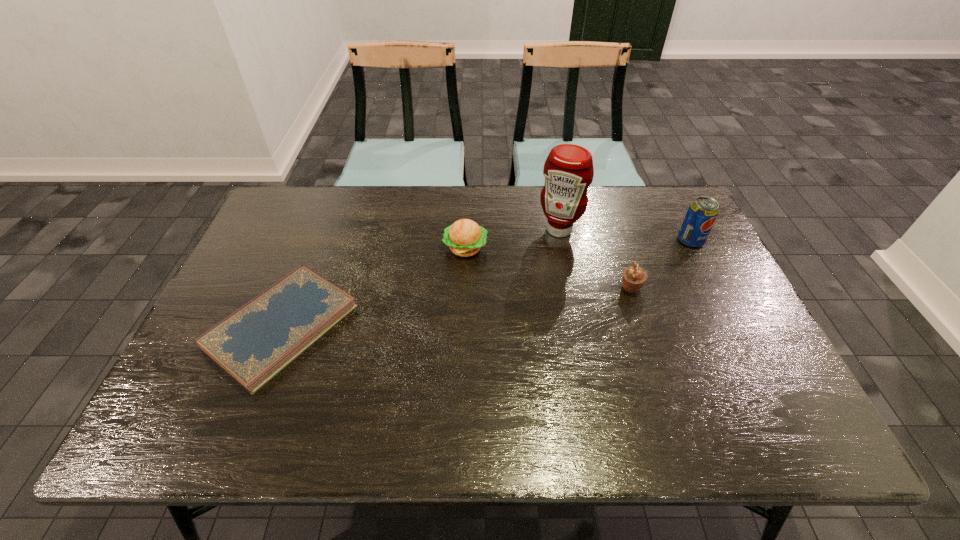
Locate an element on the screen. Image resolution: width=960 pixels, height=540 pixels. vacant space at the far left corner of the desktop is located at coordinates (288, 224).

At what (x,y) coordinates should I click in order to perform the action: click on vacant space at the far right corner of the desktop. Please return your answer as a coordinate pair (x, y). Looking at the image, I should click on (656, 190).

Find the location of `free space between the soda and the leftmost object`. free space between the soda and the leftmost object is located at coordinates (486, 284).

This screenshot has width=960, height=540. Identify the location of free space between the rightmost object and the leftmost object. (486, 284).

I want to click on free spot between the paperback book and the tallest object, so click(420, 278).

Identify the location of free point between the rightmost object and the shortest object. Image resolution: width=960 pixels, height=540 pixels. (486, 284).

Locate an element on the screen. The image size is (960, 540). free area in between the shortest object and the hamburger is located at coordinates (373, 287).

This screenshot has height=540, width=960. Find the location of `vacant space that's between the fourth shortest object and the hamburger`. vacant space that's between the fourth shortest object and the hamburger is located at coordinates (578, 245).

I want to click on vacant space that is in between the fourth shortest object and the leftmost object, so click(x=486, y=284).

The image size is (960, 540). Find the location of `empty location between the rightmost object and the shortest object`. empty location between the rightmost object and the shortest object is located at coordinates (486, 284).